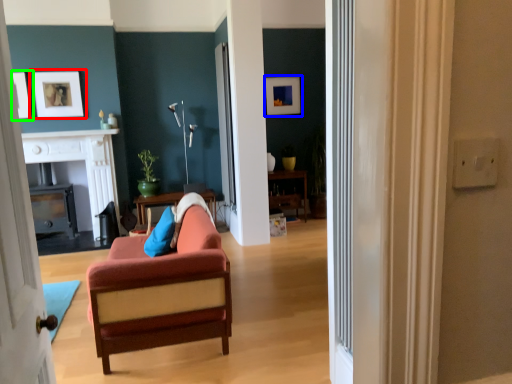
Question: Which is farther away from picture frame (highlighted by a red box)? picture frame (highlighted by a blue box) or picture frame (highlighted by a green box)?

Choices:
 (A) picture frame
 (B) picture frame

Answer: (A)